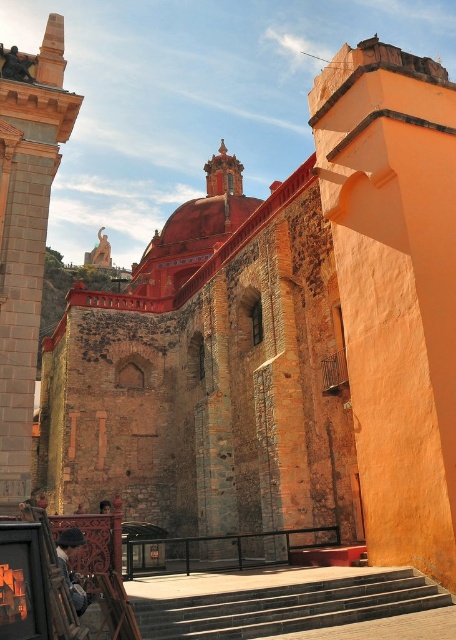
Can you confirm if smooth stone tower at left is positioned above smooth stone stairs at center?

Correct, smooth stone tower at left is located above smooth stone stairs at center.

What do you see at coordinates (25, 232) in the screenshot? I see `smooth stone tower at left` at bounding box center [25, 232].

Where is `smooth stone tower at left`? This screenshot has height=640, width=456. smooth stone tower at left is located at coordinates (25, 232).